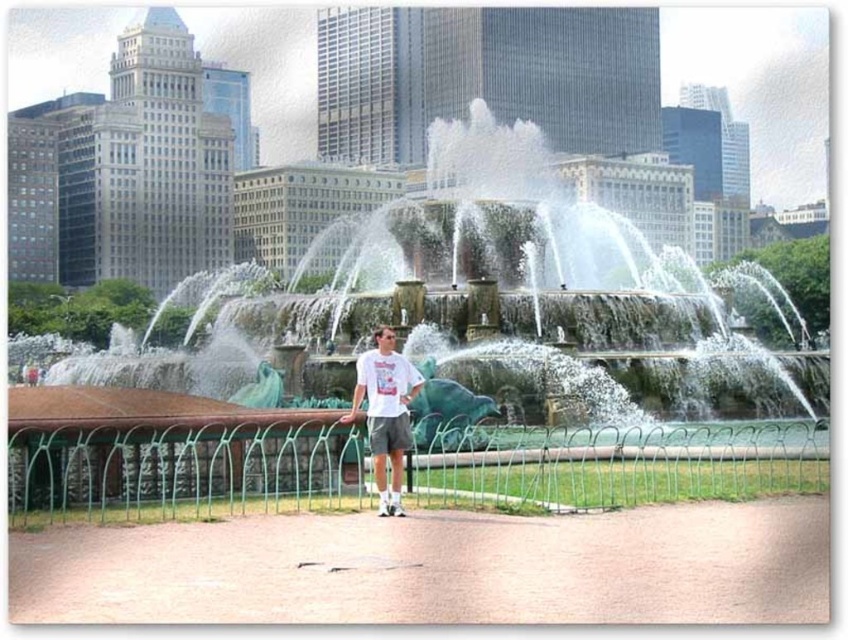
You are standing on the paved pathway near the fountain and want to take a photo of the green patina water at center. Where should you position yourself to capture the best view?

The green patina water at center is located at point (486, 305), so you should position yourself directly in front of that coordinate to capture the best view.